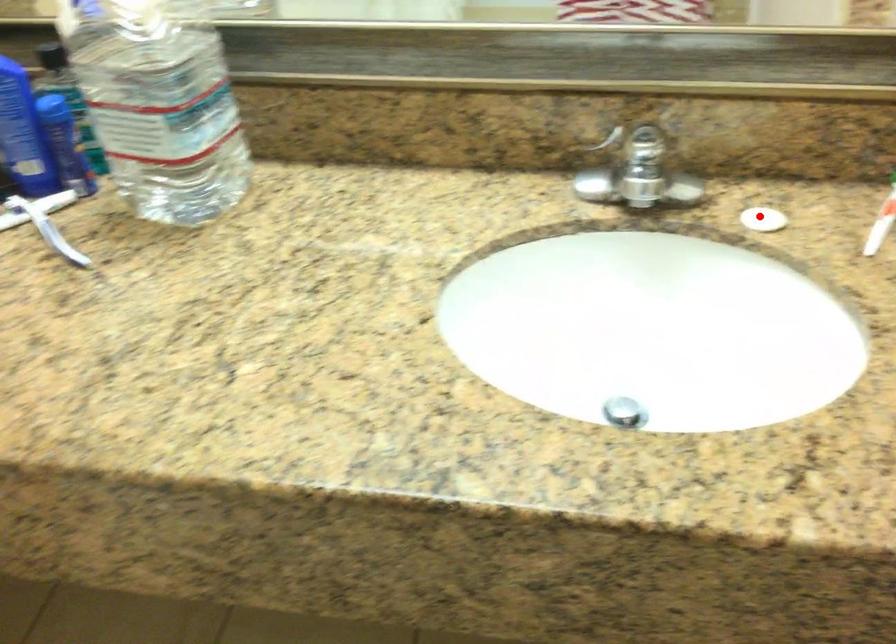
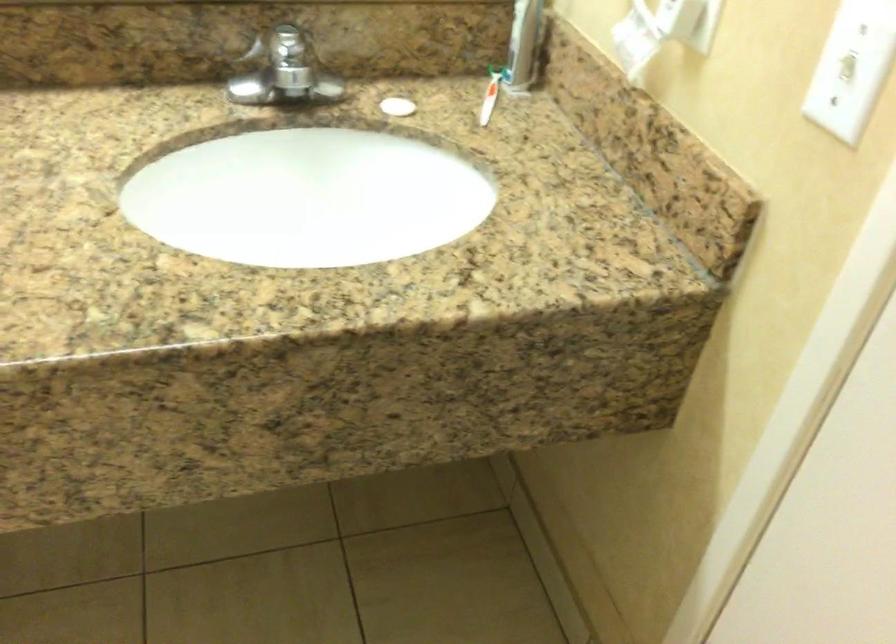
Question: I am providing you with two images of the same scene from different viewpoints. A red point is shown in image1. For the corresponding object point in image2, is it positioned nearer or farther from the camera?

Choices:
 (A) Nearer
 (B) Farther

Answer: (B)